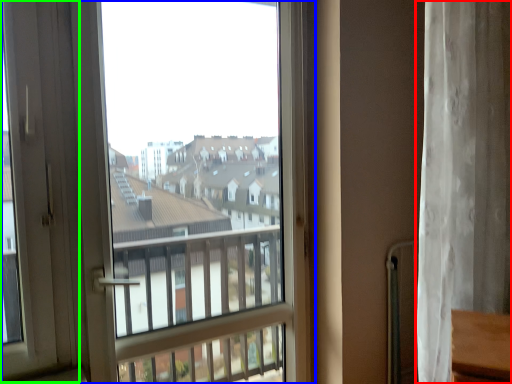
Question: Which object is the closest to the curtain (highlighted by a red box)? Choose among these: window (highlighted by a blue box) or screen door (highlighted by a green box).

Choices:
 (A) window
 (B) screen door

Answer: (A)